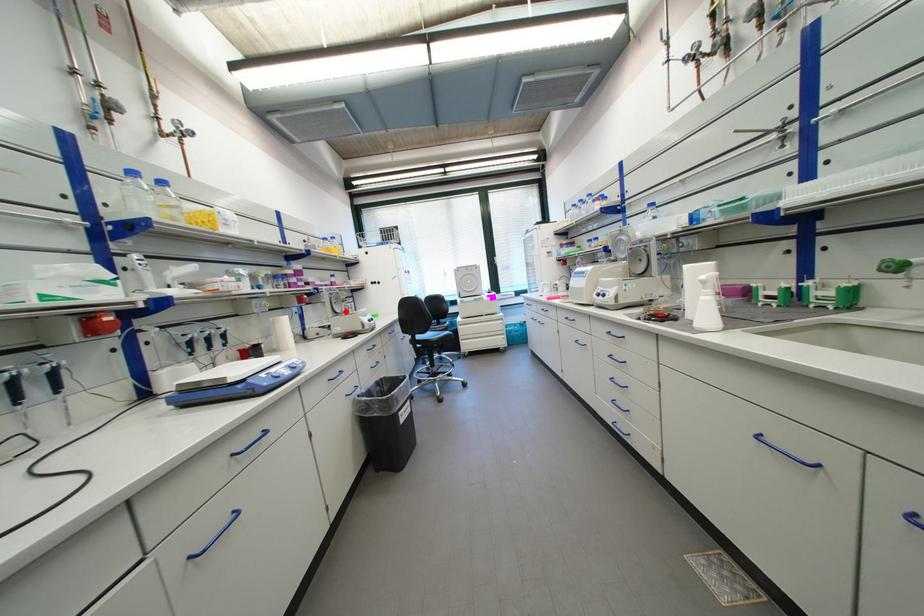
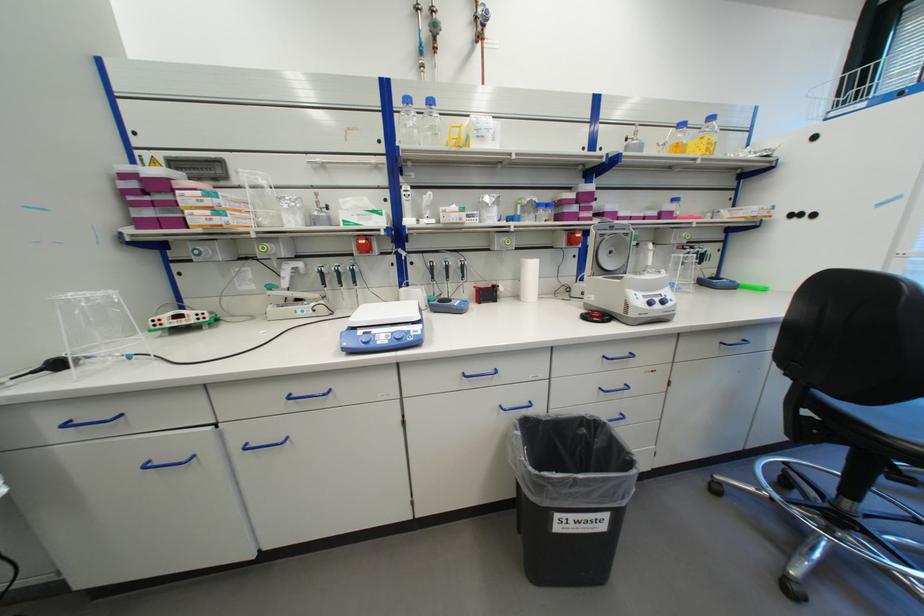
Find the pixel in the second image that matches the highlighted location in the first image.

(616, 267)